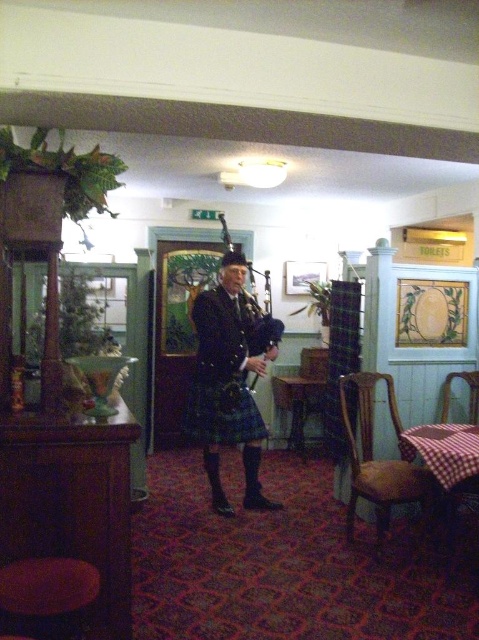
Question: Does dark brown wooden stool at lower left lie behind matte black bagpipes at center?

Choices:
 (A) yes
 (B) no

Answer: (B)

Question: Which object is closer to the camera taking this photo?

Choices:
 (A) brown wooden chair at lower right
 (B) checkered fabric chair at lower right
 (C) matte black bagpipes at center

Answer: (A)

Question: Which of the following is the farthest from the observer?

Choices:
 (A) matte black kilt at center
 (B) brown wooden chair at lower right
 (C) brown wooden chair at center

Answer: (C)

Question: Is brown wooden chair at lower right bigger than brown wooden chair at center?

Choices:
 (A) yes
 (B) no

Answer: (A)

Question: Estimate the real-world distances between objects in this image. Which object is farther from the checkered fabric chair at lower right?

Choices:
 (A) brown wooden chair at lower right
 (B) woven fabric chair at lower right

Answer: (A)

Question: Can you confirm if brown wooden chair at center is wider than woven fabric chair at lower right?

Choices:
 (A) yes
 (B) no

Answer: (A)